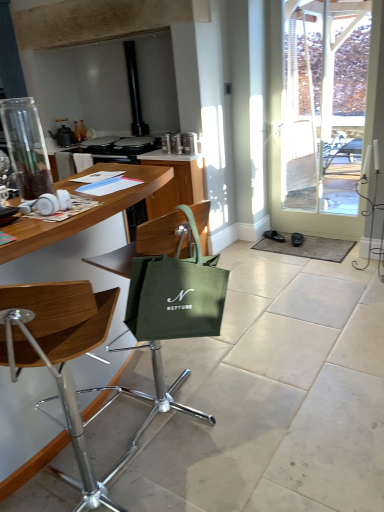
Locate an element on the screen. vacant space that is to the left of black leather shoe at lower right, the 2th footwear from the left is located at coordinates (278, 247).